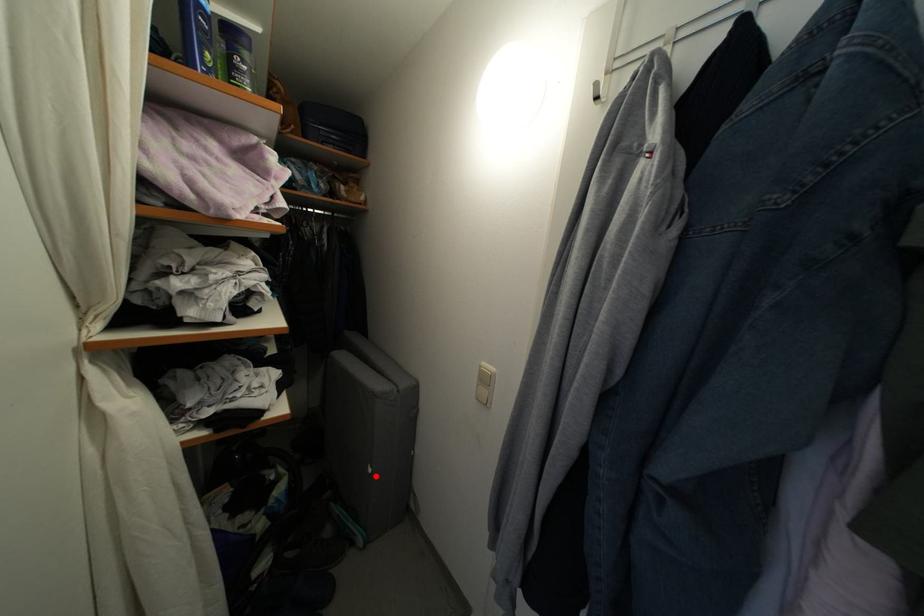
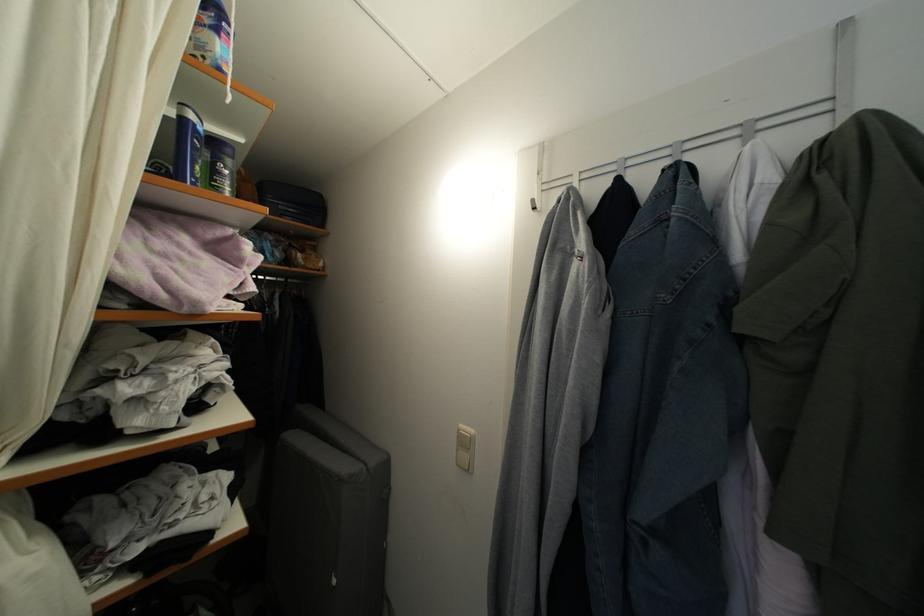
Where in the second image is the point corresponding to the highlighted location from the first image?

(339, 588)